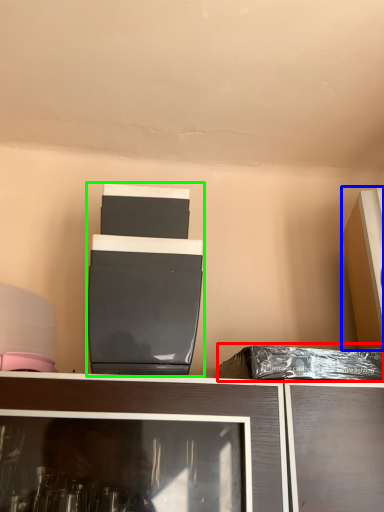
Question: Which object is the closest to the garbage (highlighted by a red box)? Choose among these: appliance (highlighted by a blue box) or appliance (highlighted by a green box).

Choices:
 (A) appliance
 (B) appliance

Answer: (A)